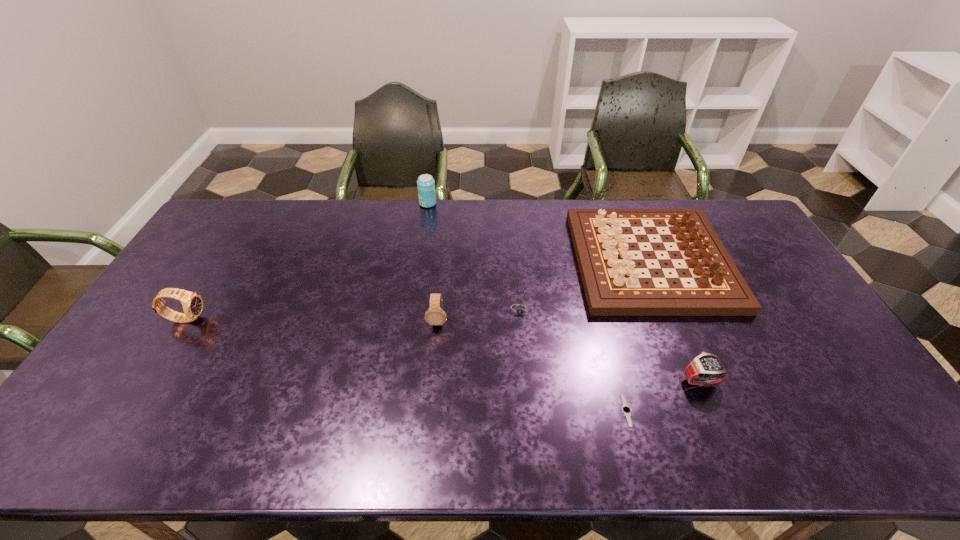
You are a GUI agent. You are given a task and a screenshot of the screen. Output one action in this format:
    pyautogui.click(x=<x>, y=<y>)
    Task: Click on the beer can that is at the far edge
    The height and width of the screenshot is (540, 960).
    Given the screenshot: What is the action you would take?
    [x=426, y=185]

The height and width of the screenshot is (540, 960). Find the location of `gameboard located at the far edge`. gameboard located at the far edge is located at coordinates (605, 248).

You are a GUI agent. You are given a task and a screenshot of the screen. Output one action in this format:
    pyautogui.click(x=<x>, y=<y>)
    Task: Click on the object that is at the near edge
    This screenshot has width=960, height=540.
    Given the screenshot: What is the action you would take?
    pyautogui.click(x=626, y=410)

Identify the location of object positioned at the left edge. This screenshot has height=540, width=960. (192, 303).

At what (x,y) coordinates should I click in order to perform the action: click on vacant space at the far edge of the desktop. Please return your answer as a coordinate pair (x, y). The image size is (960, 540). Looking at the image, I should click on (300, 219).

The height and width of the screenshot is (540, 960). I want to click on vacant region at the near edge, so tap(514, 454).

Locate an element on the screen. The width and height of the screenshot is (960, 540). free space at the right edge is located at coordinates coord(773,261).

Where is `vacant space at the far left corner`? The image size is (960, 540). vacant space at the far left corner is located at coordinates (249, 227).

Where is `vacant area that lies between the farthest object and the third shortest object`? The height and width of the screenshot is (540, 960). vacant area that lies between the farthest object and the third shortest object is located at coordinates (564, 292).

Where is `vacant point located between the second watch from right to left and the fifth object from right to left`? This screenshot has width=960, height=540. vacant point located between the second watch from right to left and the fifth object from right to left is located at coordinates (532, 366).